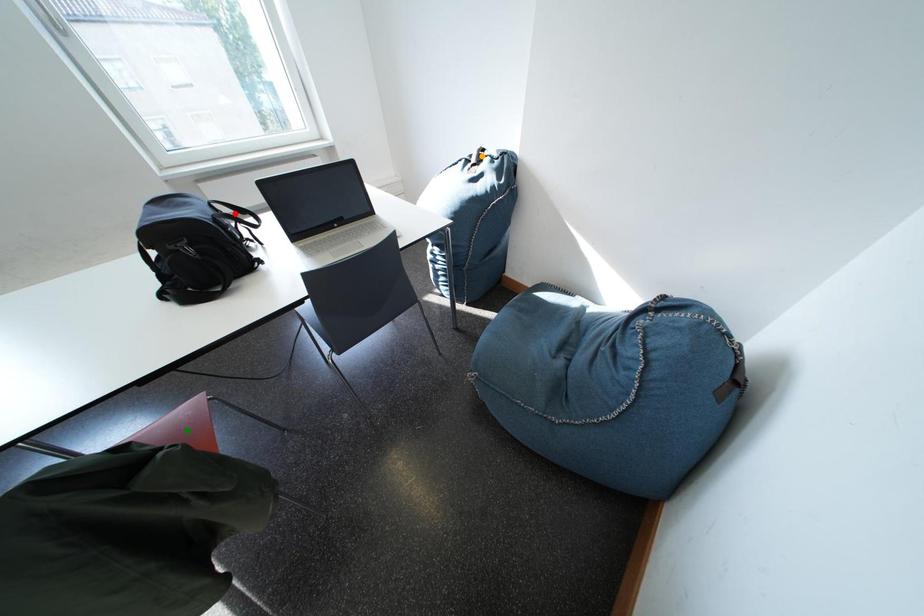
Order these from nearest to farthest:
A) red point
B) orange point
C) green point

green point < red point < orange point